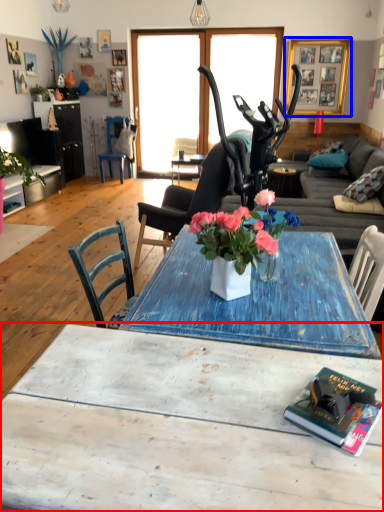
Question: Among these objects, which one is farthest to the camera, coffee table (highlighted by a red box) or picture frame (highlighted by a blue box)?

Choices:
 (A) coffee table
 (B) picture frame

Answer: (B)